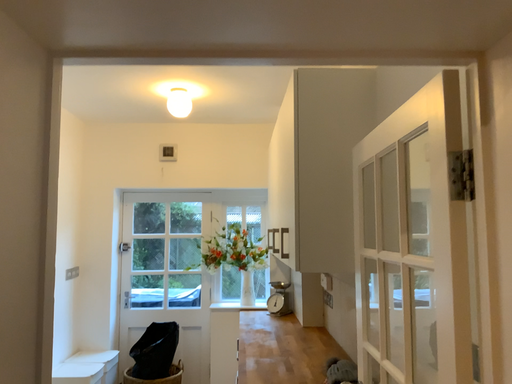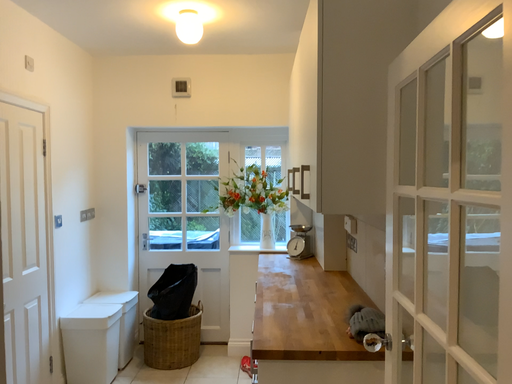
Question: How did the camera likely rotate when shooting the video?

Choices:
 (A) rotated upward
 (B) rotated downward

Answer: (B)